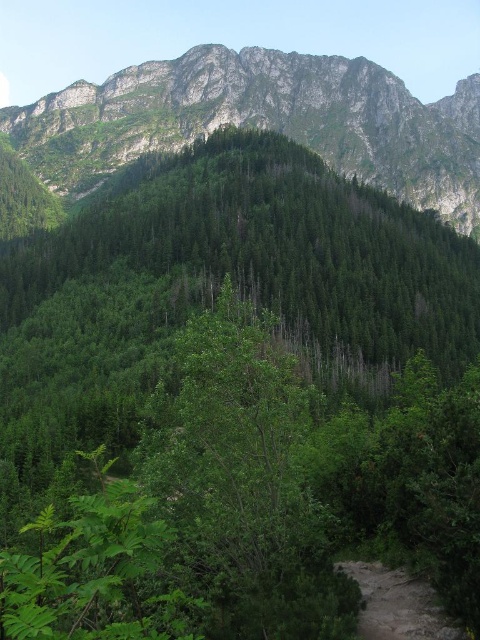
You are navigating a drone through the forest depicted in the image. Your goal is to reach the green forested mountain at upper center. Based on the coordinates provided, which direction should you steer the drone from the current position at the lower part of the image?

The green forested mountain at upper center is located at coordinates point (x=264, y=122). Since the drone is at the lower part of the image, you should steer it upward towards the upper center direction to reach the mountain.

You are a hiker planning to hike from the dirt path at lower right to the green forested mountain at upper center. Given that the distance between them is 210.76 meters, and your average hiking pace is 50 meters per hour, how many hours will it take you to reach the mountain?

The distance between the dirt path at lower right and the green forested mountain at upper center is 210.76 meters. At a pace of 50 meters per hour, it would take approximately 4.215 hours to reach the mountain.

You are a hiker planning to take the dirt path at lower right to reach the green forested mountain at upper center. Based on the scene description, can you determine if the mountain is wider than the path?

The green forested mountain at upper center might be wider than dirt path at lower right, so it is possible that the mountain is wider than the path.